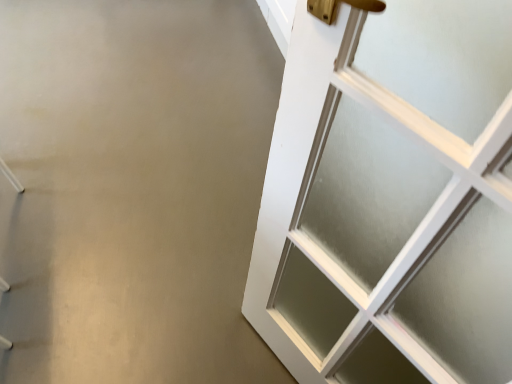
What are the coordinates of `vacant space to the left of white frosted glass door at upper right` in the screenshot? It's located at (223, 187).